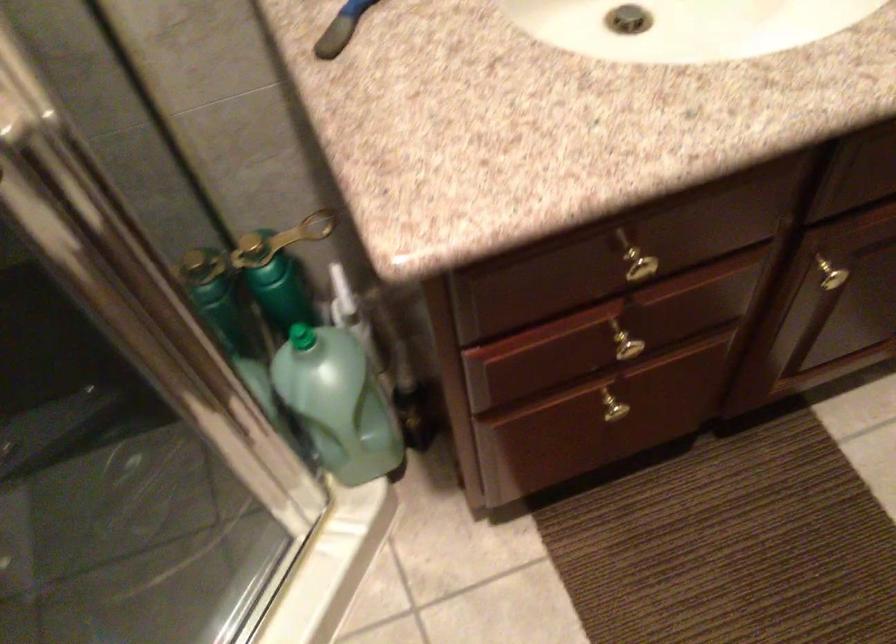
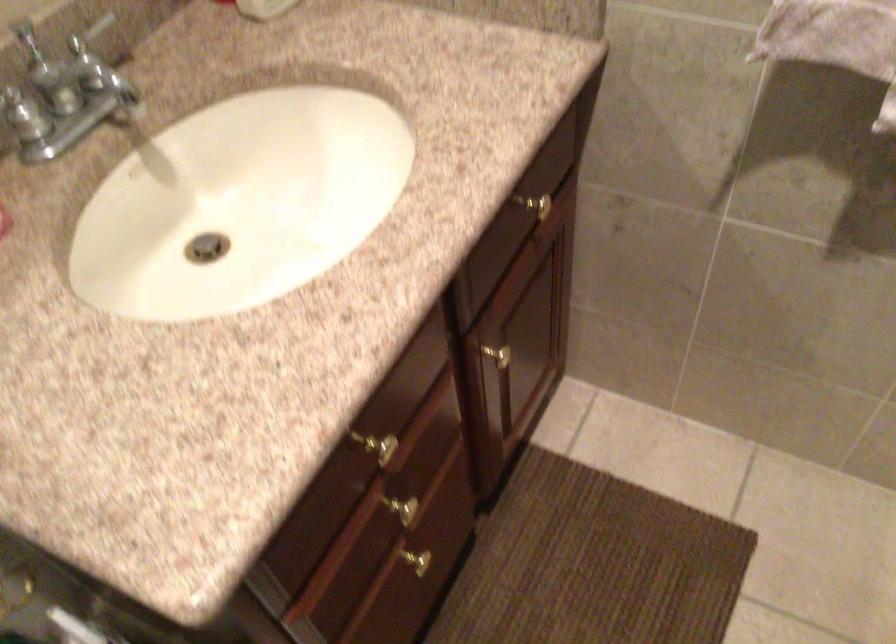
Question: How did the camera likely rotate?

Choices:
 (A) Left
 (B) Right
 (C) Up
 (D) Down

Answer: (B)